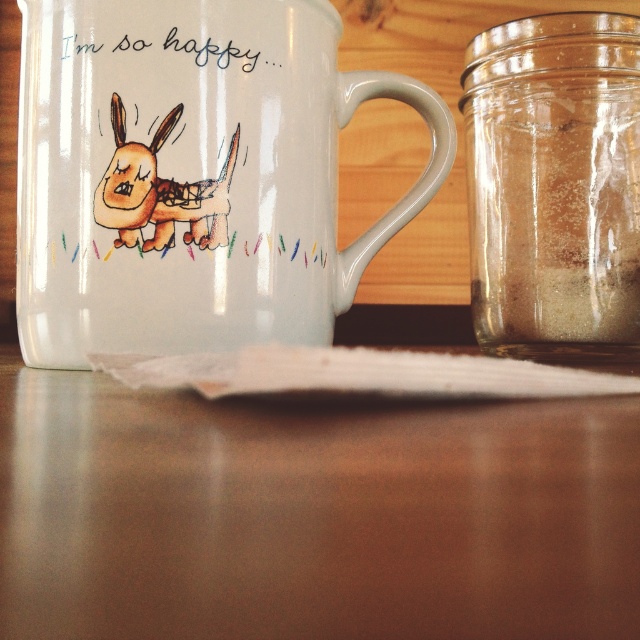
You are holding a camera and want to take a photo where both the white glossy mug at upper center and the transparent glass jar at right are in focus. Based on their positions, which object should you adjust your focus on to ensure both are clear?

The white glossy mug at upper center is closer to the viewer than the transparent glass jar at right. To ensure both are in focus, adjust your focus on the white glossy mug at upper center since it is closer, as depth of field typically extends further behind the focal point than in front.

You are arranging items on the matte brown table at center and the transparent glass jar at right. If you want to place a new item between them, where should you position it?

You should place the new item between the matte brown table at center and the transparent glass jar at right, as the matte brown table at center is to the left of the transparent glass jar at right.

You are setting up a small table for a tea party. You have a matte brown table at center and a white glossy mug at upper center. Which object is shorter and needs to be placed on top of the other?

The matte brown table at center is shorter than the white glossy mug at upper center, so the table should be placed under the mug.